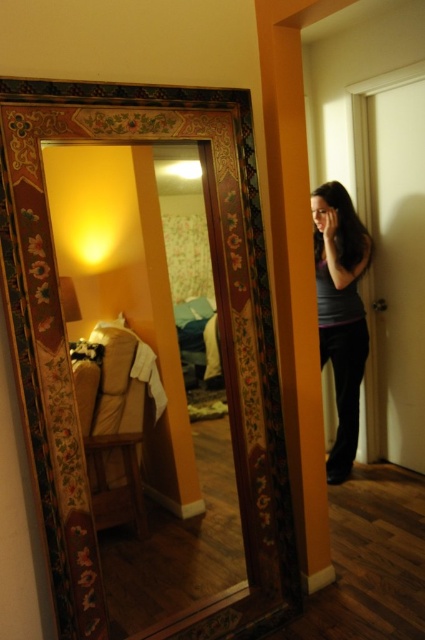
You are standing in the room and see two points marked in the mirror. The first point is at position (138, 381) and the second is at (359, 355). Which point is closer to you?

The point at (138, 381) is closer to the viewer than the point at (359, 355).

You are standing in the room and want to move from the wooden mirror at center to the matte gray shirt at right. Is the distance between them sufficient to allow you to walk straight without needing to adjust your path?

The distance between the wooden mirror at center and the matte gray shirt at right is 4.42 feet, which is enough space to walk straight without needing to adjust your path.